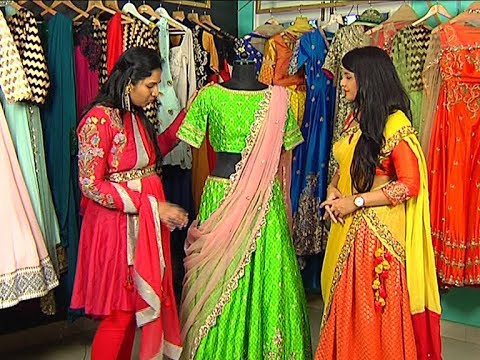
Locate an element on the screen. The image size is (480, 360). mannequin is located at coordinates (249, 84).